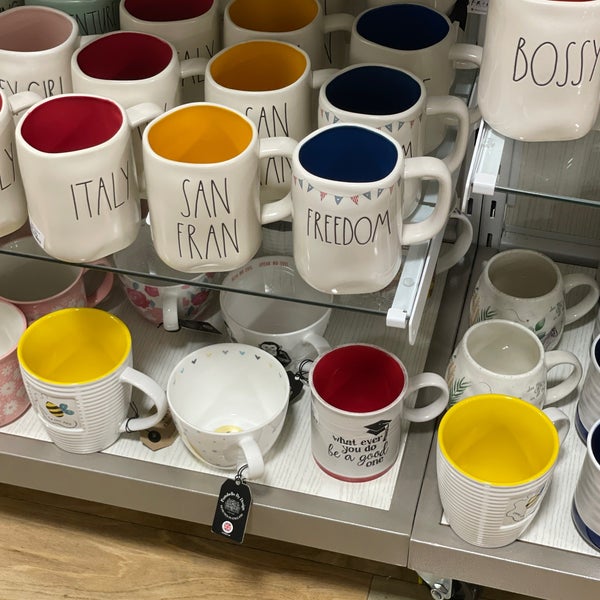
Where is `metal framing`? The height and width of the screenshot is (600, 600). metal framing is located at coordinates (372, 548), (453, 560), (495, 222), (475, 215).